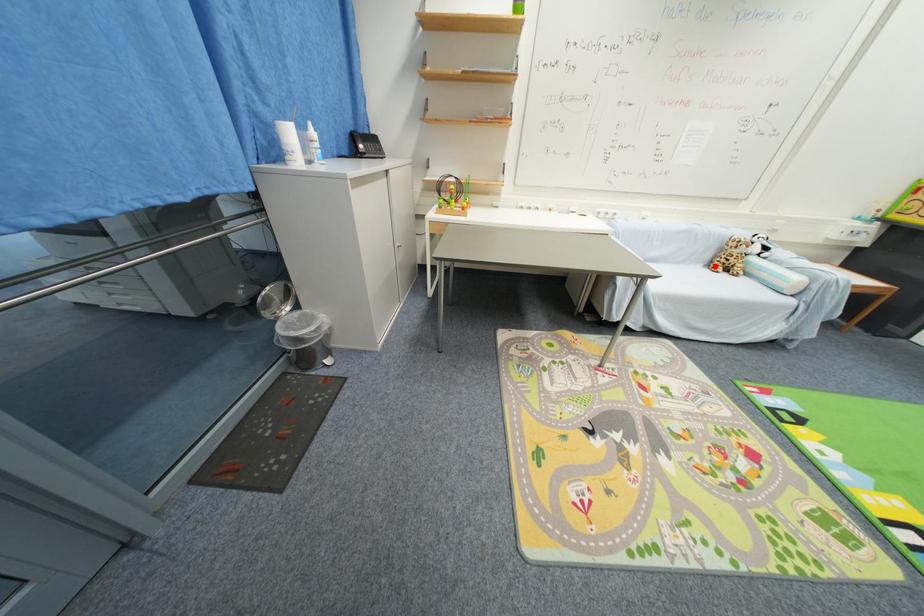
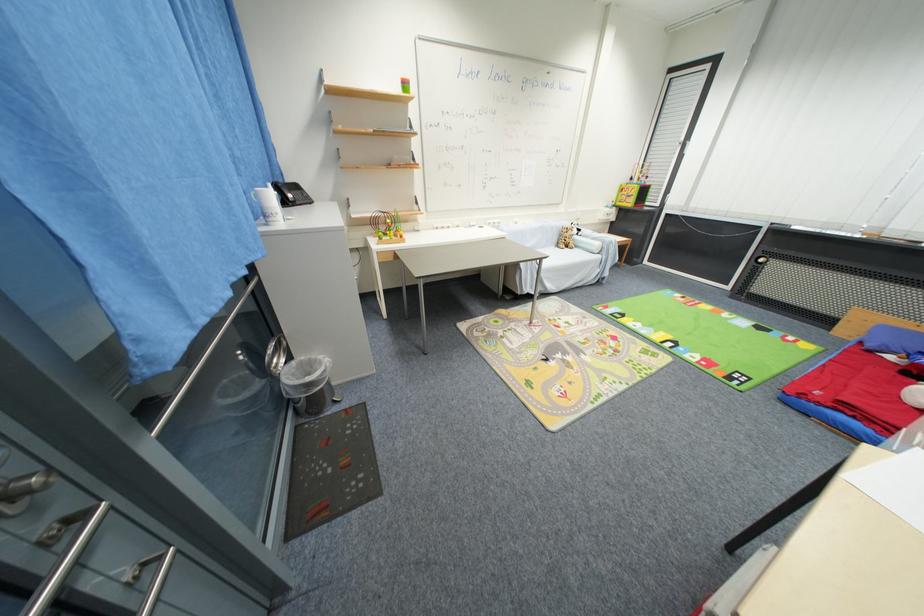
Question: I am providing you with two images of the same scene from different viewpoints. Given a red point in image1, look at the same physical point in image2. Is it:

Choices:
 (A) Closer to the viewpoint
 (B) Farther from the viewpoint

Answer: (B)